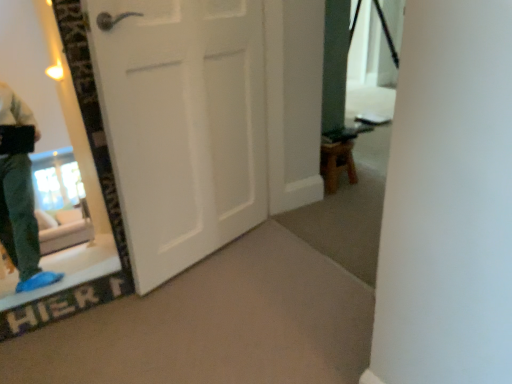
What are the coordinates of `wooden stool at lower right` in the screenshot? It's located at (337, 164).

Describe the element at coordinates (337, 164) in the screenshot. This screenshot has height=384, width=512. I see `wooden stool at lower right` at that location.

You are a GUI agent. You are given a task and a screenshot of the screen. Output one action in this format:
    pyautogui.click(x=<x>, y=<y>)
    Task: Click on the white matte door at center
    The height and width of the screenshot is (384, 512).
    Given the screenshot: What is the action you would take?
    pyautogui.click(x=182, y=125)

Consider the image. In order to face white matte door at center, should I rotate leftwards or rightwards?

To face it directly, rotate left by 8.017 degrees.

This screenshot has height=384, width=512. Describe the element at coordinates (182, 125) in the screenshot. I see `white matte door at center` at that location.

I want to click on wooden stool at lower right, so click(x=337, y=164).

Considering the relative positions of wooden stool at lower right and white matte door at center in the image provided, is wooden stool at lower right to the left of white matte door at center from the viewer's perspective?

In fact, wooden stool at lower right is to the right of white matte door at center.

Which is in front, wooden stool at lower right or white matte door at center?

white matte door at center.

Which is less distant, (352,165) or (147,21)?

Point (147,21)

From the image's perspective, is wooden stool at lower right on white matte door at center?

Yes, from the image's perspective, wooden stool at lower right is above white matte door at center.

From a real-world perspective, is wooden stool at lower right located higher than white matte door at center?

No, from a real-world perspective, wooden stool at lower right is not on top of white matte door at center.

Considering the sizes of objects wooden stool at lower right and white matte door at center in the image provided, who is wider, wooden stool at lower right or white matte door at center?

With larger width is wooden stool at lower right.

Which of these two, wooden stool at lower right or white matte door at center, stands taller?

Standing taller between the two is white matte door at center.

Between wooden stool at lower right and white matte door at center, which one has smaller size?

wooden stool at lower right.

Is wooden stool at lower right not inside white matte door at center?

That's correct, wooden stool at lower right is outside of white matte door at center.

Would you say wooden stool at lower right is a long distance from white matte door at center?

No, there isn't a large distance between wooden stool at lower right and white matte door at center.

Is wooden stool at lower right facing away from white matte door at center?

No, wooden stool at lower right's orientation is not away from white matte door at center.

In order to click on furniture that is on the right side of white matte door at center in this screenshot , I will do `click(337, 164)`.

Which object is positioned more to the right, white matte door at center or wooden stool at lower right?

wooden stool at lower right.

In the scene shown: Is white matte door at center in front of or behind wooden stool at lower right in the image?

Clearly, white matte door at center is in front of wooden stool at lower right.

Is point (261, 170) behind point (321, 149)?

That is False.

From the image's perspective, is white matte door at center beneath wooden stool at lower right?

Yes, from the image's perspective, white matte door at center is below wooden stool at lower right.

From a real-world perspective, is white matte door at center physically located above or below wooden stool at lower right?

white matte door at center is above wooden stool at lower right.

Between white matte door at center and wooden stool at lower right, which one has larger width?

wooden stool at lower right is wider.

From their relative heights in the image, would you say white matte door at center is taller or shorter than wooden stool at lower right?

white matte door at center is taller than wooden stool at lower right.

Looking at this image, is white matte door at center smaller than wooden stool at lower right?

Actually, white matte door at center might be larger than wooden stool at lower right.

Is white matte door at center surrounding wooden stool at lower right?

No, wooden stool at lower right is located outside of white matte door at center.

Would you say white matte door at center is a long distance from wooden stool at lower right?

white matte door at center is near wooden stool at lower right, not far away.

Is wooden stool at lower right at the back of white matte door at center?

No, white matte door at center's orientation is not away from wooden stool at lower right.

At what (x,y) coordinates should I click in order to perform the action: click on door above the wooden stool at lower right (from a real-world perspective). Please return your answer as a coordinate pair (x, y). Looking at the image, I should click on (182, 125).

This screenshot has height=384, width=512. I want to click on door that appears above the wooden stool at lower right (from a real-world perspective), so click(x=182, y=125).

Locate an element on the screen. This screenshot has width=512, height=384. door below the wooden stool at lower right (from the image's perspective) is located at coordinates (182, 125).